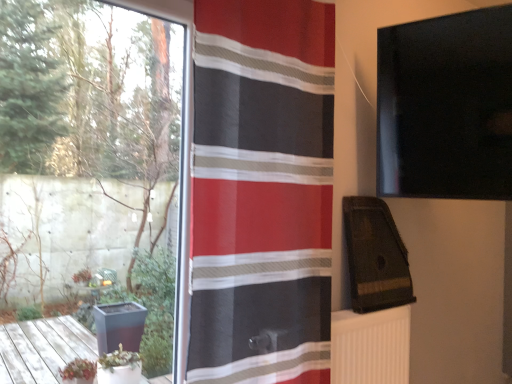
At what (x,y) coordinates should I click in order to perform the action: click on transparent glass window at left. Please return your answer as a coordinate pair (x, y). Image resolution: width=512 pixels, height=384 pixels. Looking at the image, I should click on (92, 161).

I want to click on red striped fabric at center, so click(x=262, y=191).

Are white ribbed radiator at lower right and transparent glass window at left located far from each other?

white ribbed radiator at lower right is far away from transparent glass window at left.

Considering the positions of points (380, 319) and (94, 33), is point (380, 319) farther from camera compared to point (94, 33)?

Yes, point (380, 319) is farther from viewer.

Could you tell me if white ribbed radiator at lower right is facing transparent glass window at left?

No, white ribbed radiator at lower right is not aimed at transparent glass window at left.

Would you say transparent glass window at left is part of white ribbed radiator at lower right's contents?

Actually, transparent glass window at left is outside white ribbed radiator at lower right.

Is point (143, 190) positioned before point (210, 103)?

No, (143, 190) is behind (210, 103).

Is transparent glass window at left placed right next to red striped fabric at center?

transparent glass window at left and red striped fabric at center are clearly separated.

Consider the image. From a real-world perspective, is transparent glass window at left on top of red striped fabric at center?

No.

Is red striped fabric at center turned away from white ribbed radiator at lower right?

No, white ribbed radiator at lower right is not at the back of red striped fabric at center.

Which is correct: red striped fabric at center is inside white ribbed radiator at lower right, or outside of it?

red striped fabric at center cannot be found inside white ribbed radiator at lower right.

From the picture: Can you tell me how much red striped fabric at center and white ribbed radiator at lower right differ in facing direction?

1.77 degrees.

From a real-world perspective, who is located lower, red striped fabric at center or transparent glass window at left?

transparent glass window at left.

Is transparent glass window at left completely or partially inside red striped fabric at center?

No.

Are transparent glass window at left and white ribbed radiator at lower right located far from each other?

Yes, transparent glass window at left and white ribbed radiator at lower right are quite far apart.

How much distance is there between transparent glass window at left and white ribbed radiator at lower right?

transparent glass window at left is 3.50 feet from white ribbed radiator at lower right.

From a real-world perspective, does transparent glass window at left stand above white ribbed radiator at lower right?

Yes, from a real-world perspective, transparent glass window at left is over white ribbed radiator at lower right

You are a GUI agent. You are given a task and a screenshot of the screen. Output one action in this format:
    pyautogui.click(x=<x>, y=<y>)
    Task: Click on the window in front of the white ribbed radiator at lower right
    Image resolution: width=512 pixels, height=384 pixels.
    Given the screenshot: What is the action you would take?
    pyautogui.click(x=92, y=161)

Is white ribbed radiator at lower right turned away from red striped fabric at center?

white ribbed radiator at lower right does not have its back to red striped fabric at center.

Consider the image. What's the angular difference between white ribbed radiator at lower right and red striped fabric at center's facing directions?

The facing directions of white ribbed radiator at lower right and red striped fabric at center are 1.77 degrees apart.

From their relative heights in the image, would you say white ribbed radiator at lower right is taller or shorter than red striped fabric at center?

Considering their sizes, white ribbed radiator at lower right has less height than red striped fabric at center.

Based on the photo, looking at their sizes, would you say white ribbed radiator at lower right is wider or thinner than red striped fabric at center?

Considering their sizes, white ribbed radiator at lower right looks broader than red striped fabric at center.

Find the location of a particular element. The height and width of the screenshot is (384, 512). window above the white ribbed radiator at lower right (from a real-world perspective) is located at coordinates (92, 161).

The height and width of the screenshot is (384, 512). In order to click on window behind the red striped fabric at center in this screenshot , I will do `click(92, 161)`.

Looking at the image, which one is located closer to red striped fabric at center, transparent glass window at left or white ribbed radiator at lower right?

The object closer to red striped fabric at center is white ribbed radiator at lower right.

When comparing their distances from transparent glass window at left, does red striped fabric at center or white ribbed radiator at lower right seem closer?

Among the two, red striped fabric at center is located nearer to transparent glass window at left.

Looking at this image, based on their spatial positions, is white ribbed radiator at lower right or transparent glass window at left closer to red striped fabric at center?

The object closer to red striped fabric at center is white ribbed radiator at lower right.

Based on their spatial positions, is red striped fabric at center or transparent glass window at left further from white ribbed radiator at lower right?

transparent glass window at left is further to white ribbed radiator at lower right.

Considering their positions, is transparent glass window at left positioned closer to white ribbed radiator at lower right than red striped fabric at center?

red striped fabric at center lies closer to white ribbed radiator at lower right than the other object.

When comparing their distances from transparent glass window at left, does white ribbed radiator at lower right or red striped fabric at center seem further?

white ribbed radiator at lower right.

The width and height of the screenshot is (512, 384). I want to click on curtain situated between transparent glass window at left and white ribbed radiator at lower right from left to right, so click(262, 191).